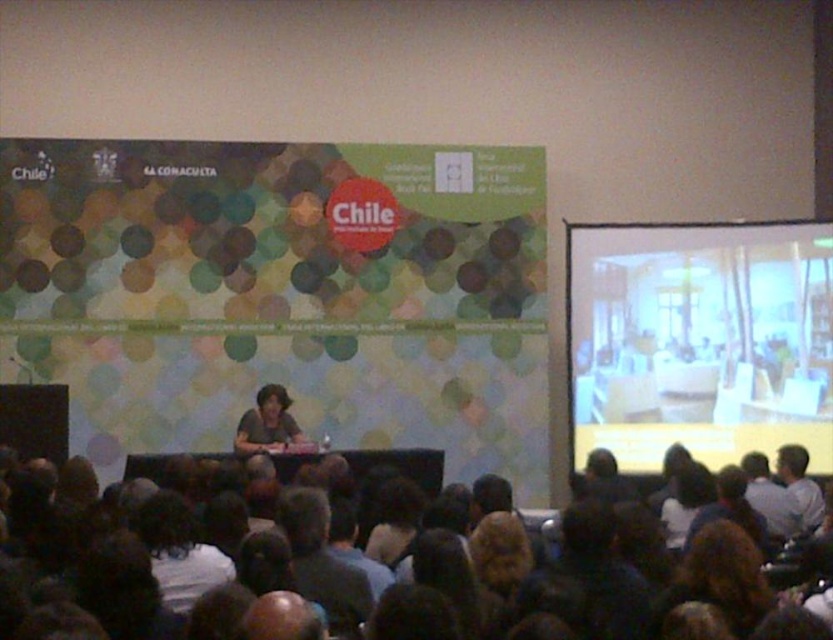
Does matte white screen at right appear under matte black shirt at center?

No.

Who is positioned more to the left, matte white screen at right or matte black shirt at center?

From the viewer's perspective, matte black shirt at center appears more on the left side.

Locate an element on the screen. The width and height of the screenshot is (833, 640). matte white screen at right is located at coordinates (699, 340).

From the picture: Which is more to the right, matte white screen at right or white shirt at lower right?

white shirt at lower right is more to the right.

Based on the photo, does matte white screen at right appear over white shirt at lower right?

Yes.

Between point (580, 416) and point (792, 496), which one is positioned in front?

Point (792, 496)

You are a GUI agent. You are given a task and a screenshot of the screen. Output one action in this format:
    pyautogui.click(x=<x>, y=<y>)
    Task: Click on the matte white screen at right
    
    Given the screenshot: What is the action you would take?
    pyautogui.click(x=699, y=340)

Does dark hair at center appear under light blue shirt at lower right?

No.

Does point (687, 596) come behind point (746, 461)?

No.

Locate an element on the screen. dark hair at center is located at coordinates (352, 579).